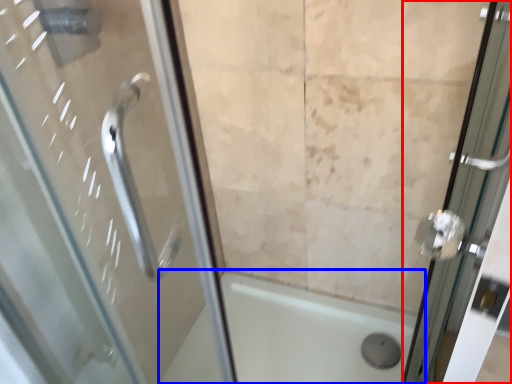
Question: Among these objects, which one is farthest to the camera, door (highlighted by a red box) or bath (highlighted by a blue box)?

Choices:
 (A) door
 (B) bath

Answer: (B)